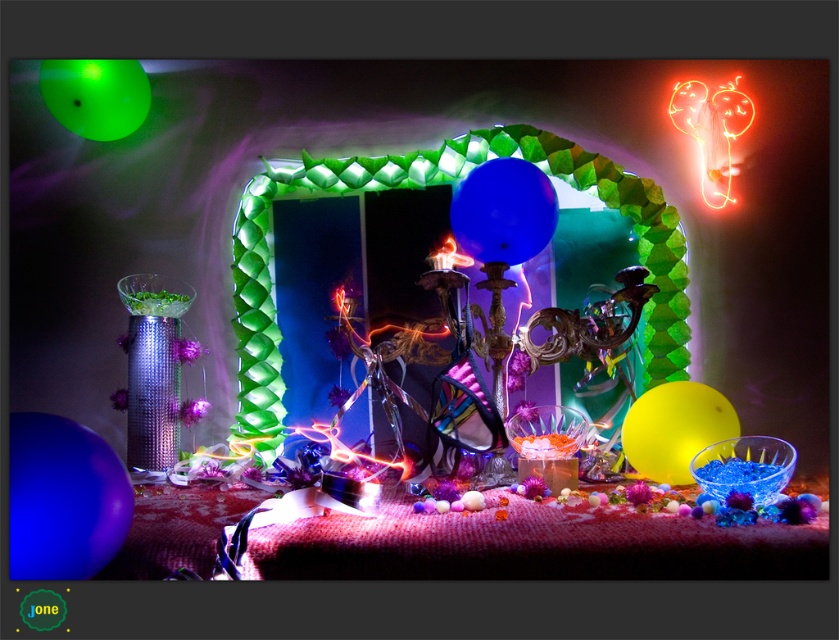
Can you confirm if matte blue balloon at center is thinner than green translucent balloon at upper left?

Yes.

Is matte blue balloon at center to the left of green translucent balloon at upper left from the viewer's perspective?

Incorrect, matte blue balloon at center is not on the left side of green translucent balloon at upper left.

Measure the distance between matte blue balloon at center and camera.

matte blue balloon at center and camera are 8.23 feet apart.

Locate an element on the screen. The height and width of the screenshot is (640, 839). matte blue balloon at center is located at coordinates (503, 211).

Where is `matte blue balloon at center`? This screenshot has height=640, width=839. matte blue balloon at center is located at coordinates (503, 211).

Is point (468, 204) farther from viewer compared to point (686, 448)?

Yes, point (468, 204) is farther from viewer.

Is point (524, 220) positioned before point (663, 481)?

No, it is not.

You are a GUI agent. You are given a task and a screenshot of the screen. Output one action in this format:
    pyautogui.click(x=<x>, y=<y>)
    Task: Click on the matte blue balloon at center
    Image resolution: width=839 pixels, height=640 pixels.
    Given the screenshot: What is the action you would take?
    pyautogui.click(x=503, y=211)

Is the position of matte blue balloon at lower left less distant than that of yellow matte balloon at center?

Yes, it is in front of yellow matte balloon at center.

In the scene shown: Does matte blue balloon at lower left have a lesser height compared to yellow matte balloon at center?

In fact, matte blue balloon at lower left may be taller than yellow matte balloon at center.

Find the location of `matte blue balloon at lower left`. matte blue balloon at lower left is located at coordinates pos(63,499).